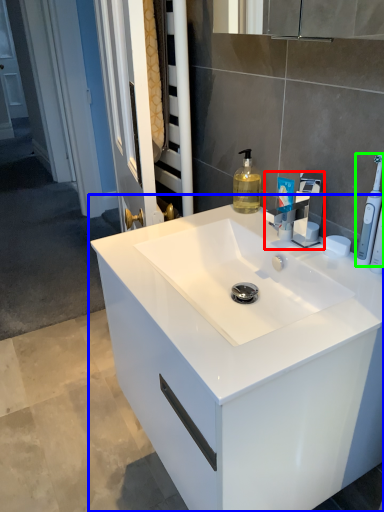
Question: Considering the real-world distances, which object is farthest from tap (highlighted by a red box)? bathroom cabinet (highlighted by a blue box) or toothbrush (highlighted by a green box)?

Choices:
 (A) bathroom cabinet
 (B) toothbrush

Answer: (A)